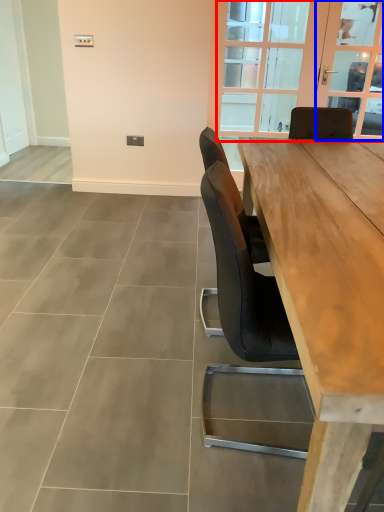
Question: Which object appears farthest to the camera in this image, window (highlighted by a red box) or window screen (highlighted by a blue box)?

Choices:
 (A) window
 (B) window screen

Answer: (B)